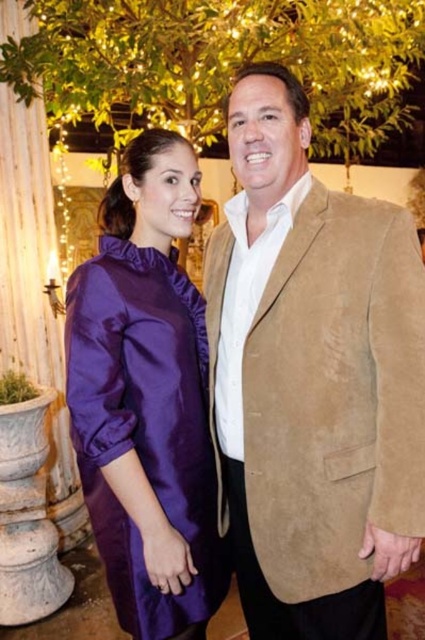
You are a photographer trying to capture a closeup of the purple satin dress at center and the suede jacket at center. Since you want to focus on the details of both garments, which one should you adjust your camera angle to prioritize? Explain your reasoning based on their positions.

The suede jacket at center is to the right of the purple satin dress at center, so you should adjust your camera angle to prioritize the purple satin dress at center to ensure both garments are in focus without overlapping.

You are a photographer trying to capture a photo of the two people in the image. You notice two points marked in the scene. The first point is at coordinate point (265, 109) and the second is at coordinate point (87, 381). Which point is closer to the camera?

Point (265, 109) is further to the viewer than point (87, 381), so the second point at (87, 381) is closer to the camera.

You are a photographer trying to focus on the suede jacket at center. The camera has a focus point at point (312,378). Is the focus point correctly placed?

Yes, the focus point at point (312,378) is correctly placed because the Objects Description states that the point is on the suede jacket at center.